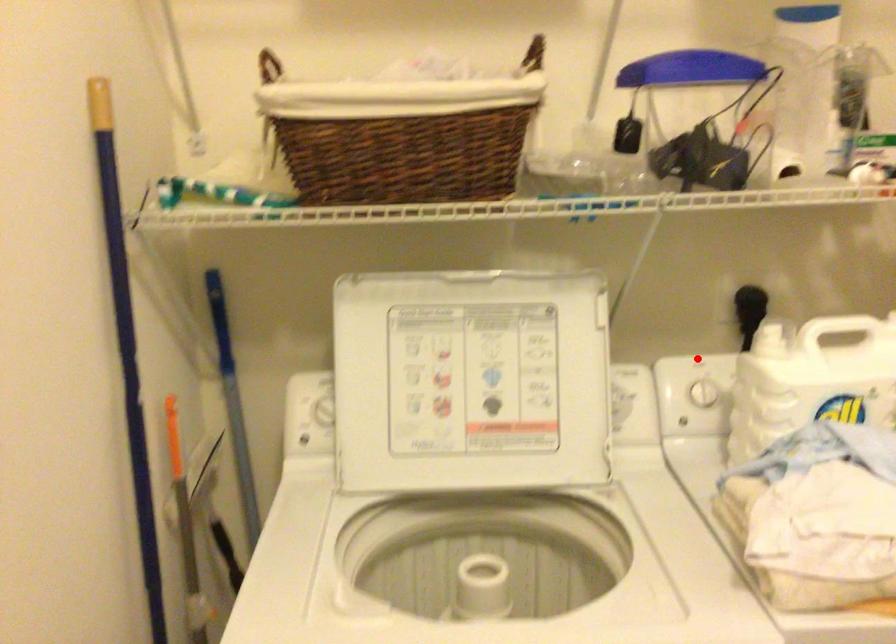
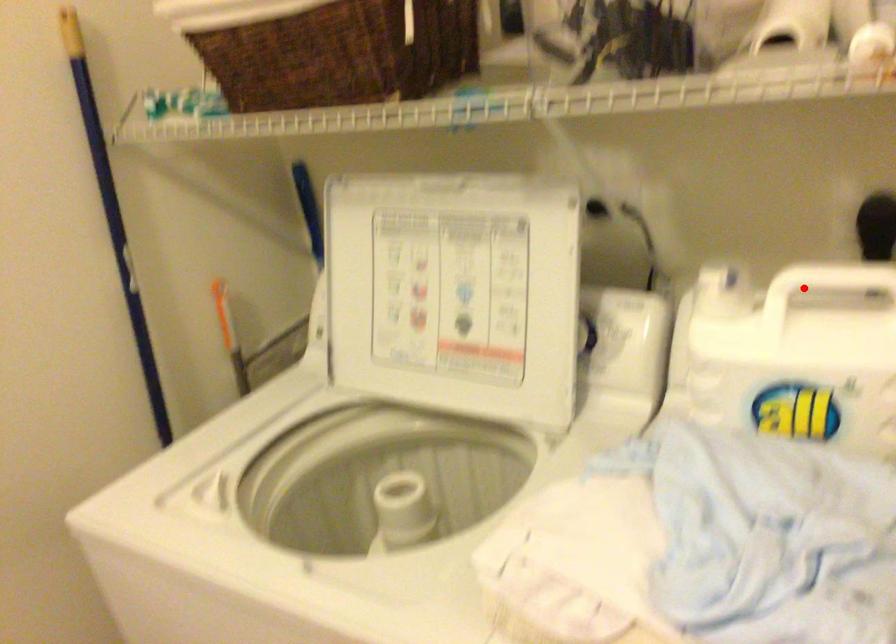
I am providing you with two images of the same scene from different viewpoints. A red point is marked on the first image and another point is marked on the second image. Do the highlighted points in image1 and image2 indicate the same real-world spot?

Yes